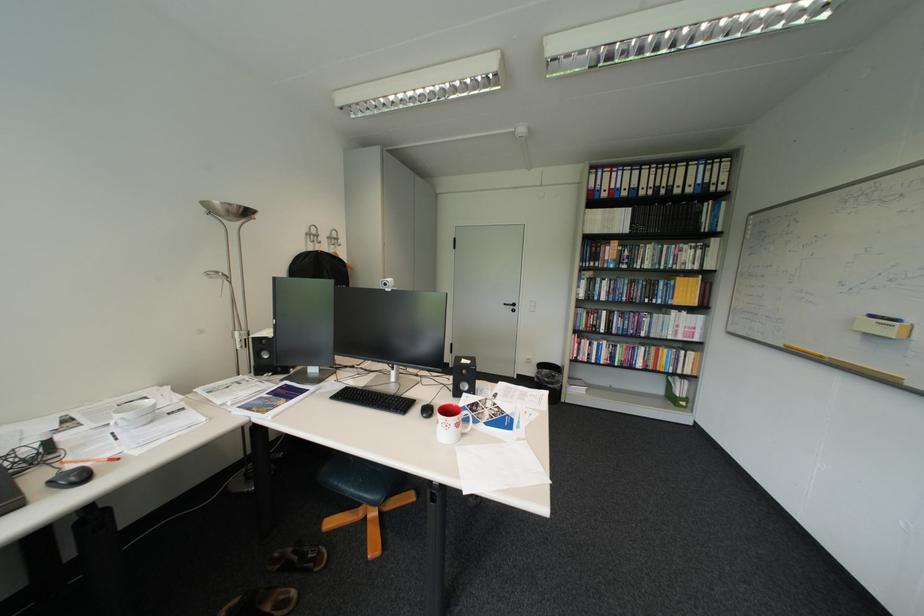
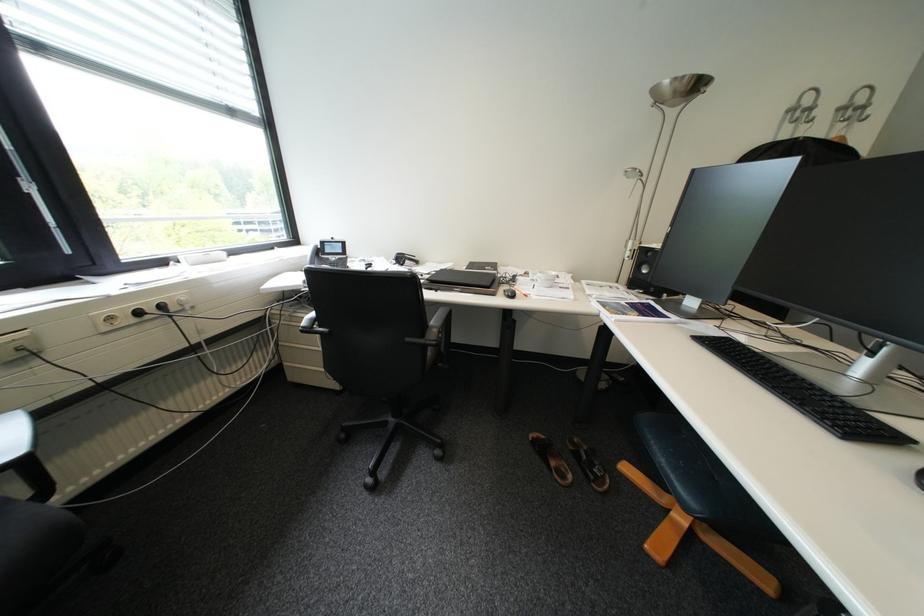
Looking at this image, based on the continuous images, in which direction is the camera rotating?

The camera rotated toward left-down.